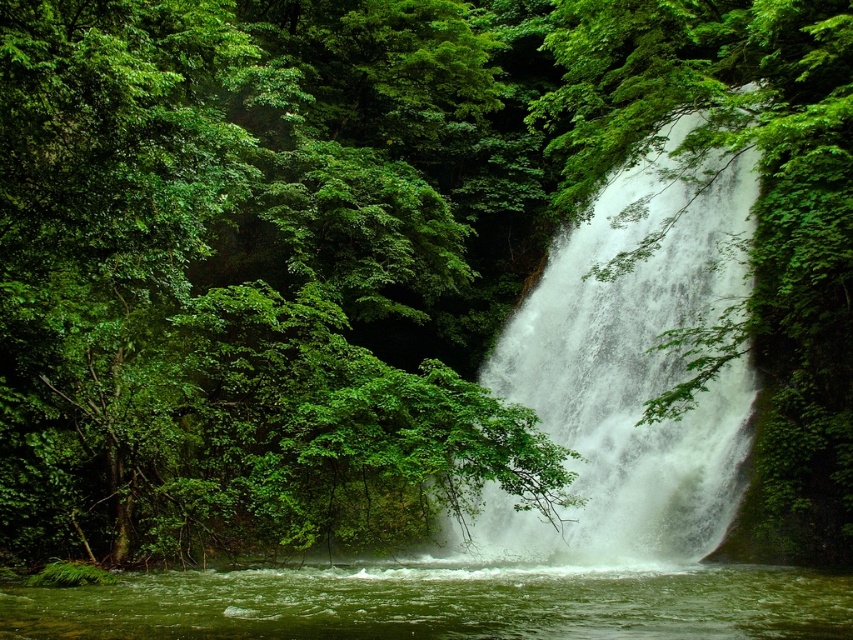
Which is behind, point (537, 512) or point (732, 625)?

Positioned behind is point (537, 512).

Which is behind, point (553, 257) or point (316, 636)?

The point (553, 257) is more distant.

The width and height of the screenshot is (853, 640). What are the coordinates of `white frothy water at center` in the screenshot? It's located at (630, 371).